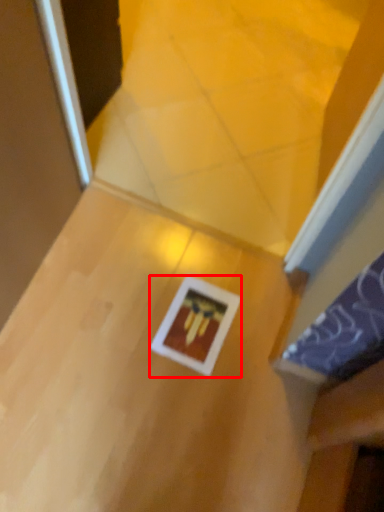
Question: In this image, where is picture frame (annotated by the red box) located relative to table?

Choices:
 (A) left
 (B) right

Answer: (B)